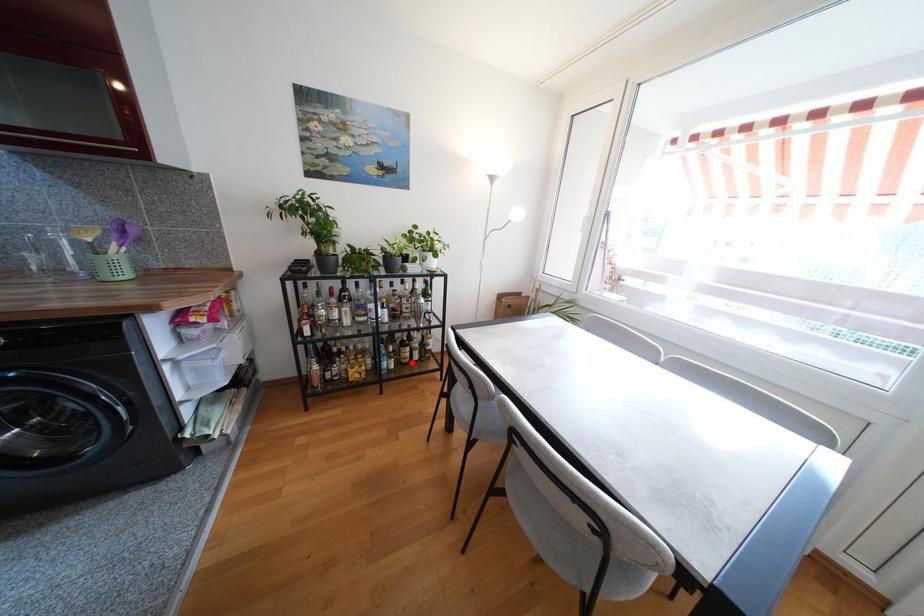
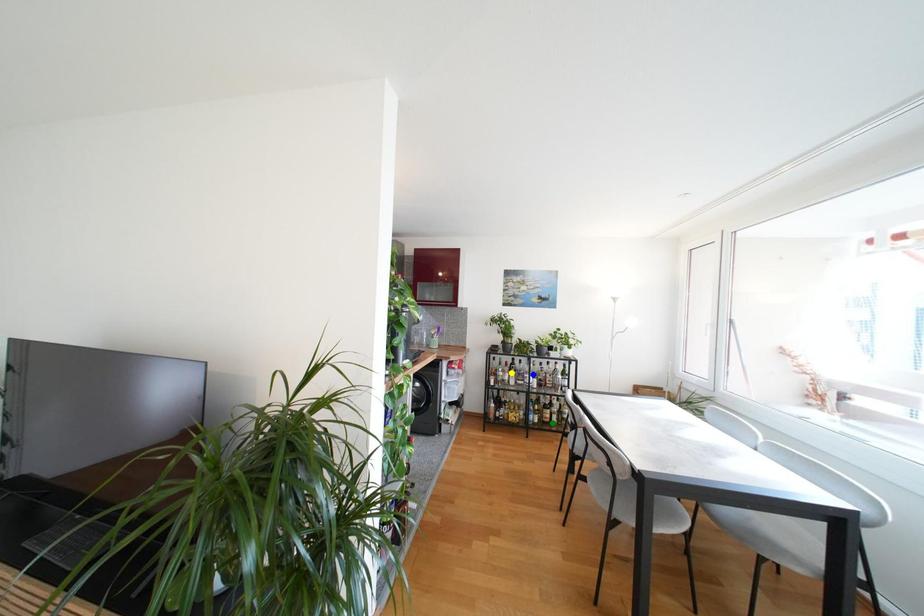
Question: I am providing you with two images of the same scene from different viewpoints. A red point is marked on the first image. You are given multiple points on the second image. Can you choose the point in image 2 that corresponds to the point in image 1?

Choices:
 (A) green point
 (B) blue point
 (C) yellow point

Answer: (A)